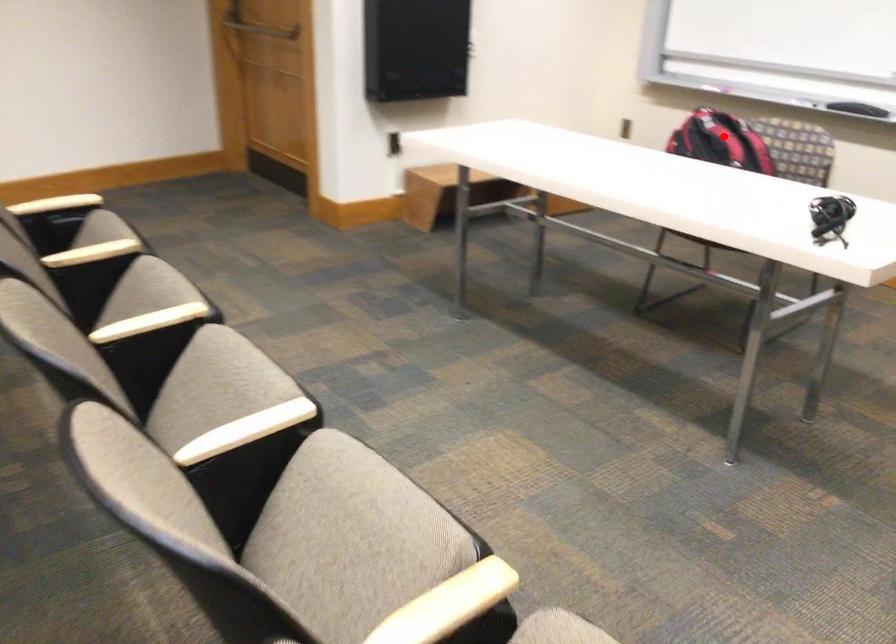
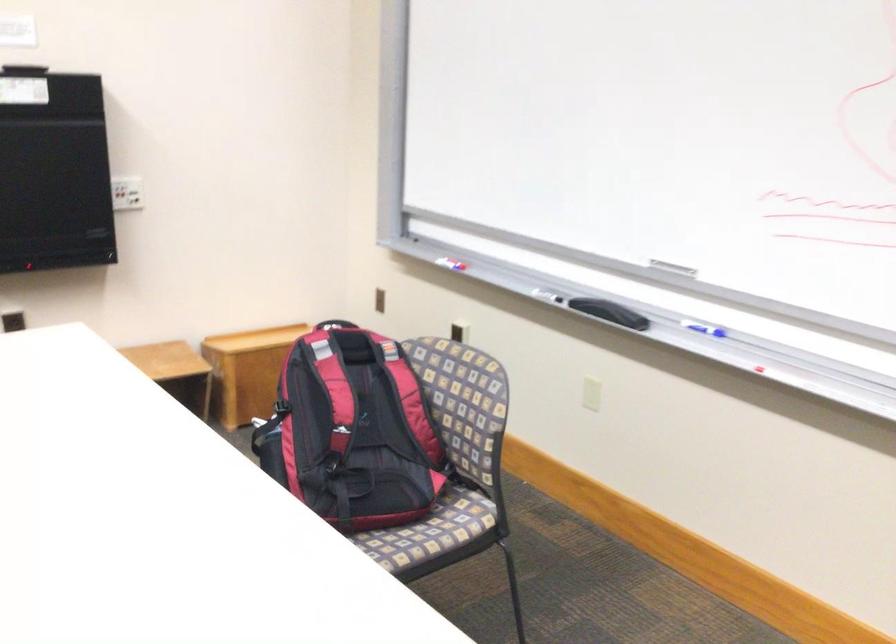
Question: I am providing you with two images of the same scene from different viewpoints. A red point is shown in image1. For the corresponding object point in image2, is it positioned nearer or farther from the camera?

Choices:
 (A) Nearer
 (B) Farther

Answer: (A)